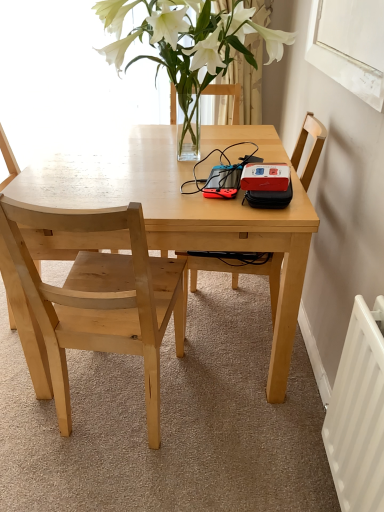
Question: Does translucent glass vase at upper center have a greater width compared to wooden chair at center, the 1th chair in the right-to-left sequence?

Choices:
 (A) no
 (B) yes

Answer: (B)

Question: From a real-world perspective, is translucent glass vase at upper center on top of wooden chair at center, the 3th chair in the left-to-right sequence?

Choices:
 (A) no
 (B) yes

Answer: (B)

Question: Considering the relative sizes of translucent glass vase at upper center and wooden chair at center, the 3th chair in the left-to-right sequence, in the image provided, is translucent glass vase at upper center bigger than wooden chair at center, the 3th chair in the left-to-right sequence,?

Choices:
 (A) no
 (B) yes

Answer: (B)

Question: Is translucent glass vase at upper center located outside wooden chair at center, the 1th chair in the right-to-left sequence?

Choices:
 (A) yes
 (B) no

Answer: (A)

Question: Is translucent glass vase at upper center not close to wooden chair at center, the 1th chair in the right-to-left sequence?

Choices:
 (A) no
 (B) yes

Answer: (A)

Question: From a real-world perspective, relative to white metal radiator at lower right, is white matte window screen at upper right vertically above or below?

Choices:
 (A) above
 (B) below

Answer: (A)

Question: Is white matte window screen at upper right taller or shorter than white metal radiator at lower right?

Choices:
 (A) short
 (B) tall

Answer: (A)

Question: From the image's perspective, is white matte window screen at upper right positioned above or below white metal radiator at lower right?

Choices:
 (A) below
 (B) above

Answer: (B)

Question: Considering their positions, is white matte window screen at upper right located in front of or behind white metal radiator at lower right?

Choices:
 (A) behind
 (B) front

Answer: (A)

Question: Considering the positions of translucent glass vase at upper center and wooden chair at center, the 3th chair in the left-to-right sequence, in the image, is translucent glass vase at upper center wider or thinner than wooden chair at center, the 3th chair in the left-to-right sequence,?

Choices:
 (A) thin
 (B) wide

Answer: (B)

Question: From the image's perspective, is translucent glass vase at upper center positioned above or below wooden chair at center, the 1th chair in the right-to-left sequence?

Choices:
 (A) above
 (B) below

Answer: (A)

Question: Based on their positions, is translucent glass vase at upper center located to the left or right of wooden chair at center, the 3th chair in the left-to-right sequence?

Choices:
 (A) right
 (B) left

Answer: (B)

Question: In terms of height, does translucent glass vase at upper center look taller or shorter compared to wooden chair at center, the 3th chair in the left-to-right sequence?

Choices:
 (A) tall
 (B) short

Answer: (B)

Question: Considering their positions, is light wood chair at left, the 2th chair viewed from the right, located in front of or behind natural wood chair at left, which appears as the third chair when viewed from the right?

Choices:
 (A) front
 (B) behind

Answer: (A)

Question: Considering the positions of point (71, 323) and point (13, 153), is point (71, 323) closer or farther from the camera than point (13, 153)?

Choices:
 (A) farther
 (B) closer

Answer: (B)